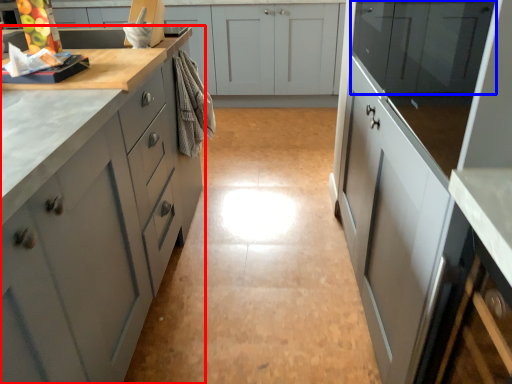
Question: Among these objects, which one is farthest to the camera, cabinetry (highlighted by a red box) or cabinetry (highlighted by a blue box)?

Choices:
 (A) cabinetry
 (B) cabinetry

Answer: (B)